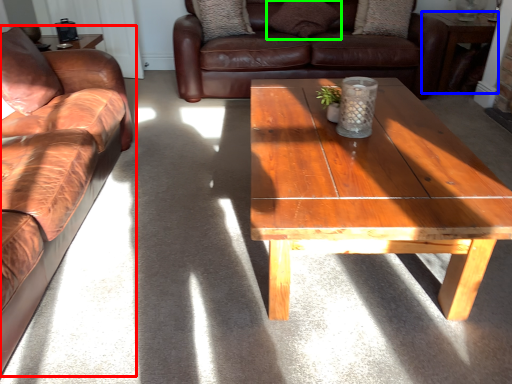
Question: Estimate the real-world distances between objects in this image. Which object is farther from studio couch (highlighted by a red box), table (highlighted by a blue box) or pillow (highlighted by a green box)?

Choices:
 (A) table
 (B) pillow

Answer: (A)